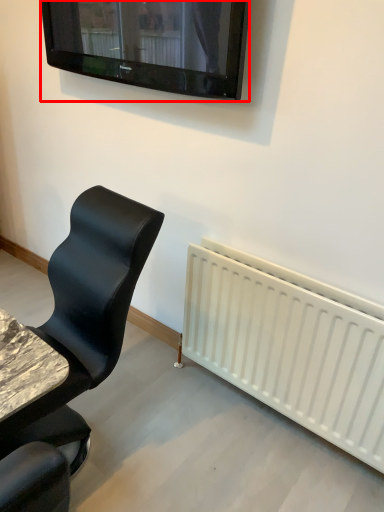
Question: From the image's perspective, where is television (annotated by the red box) located relative to chair?

Choices:
 (A) below
 (B) above

Answer: (B)